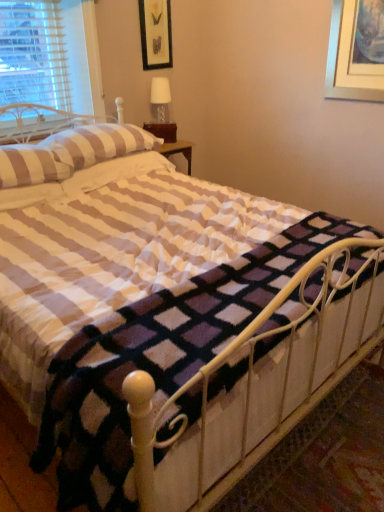
Locate an element on the screen. free space above white metal bed frame at center (from a real-world perspective) is located at coordinates (230, 288).